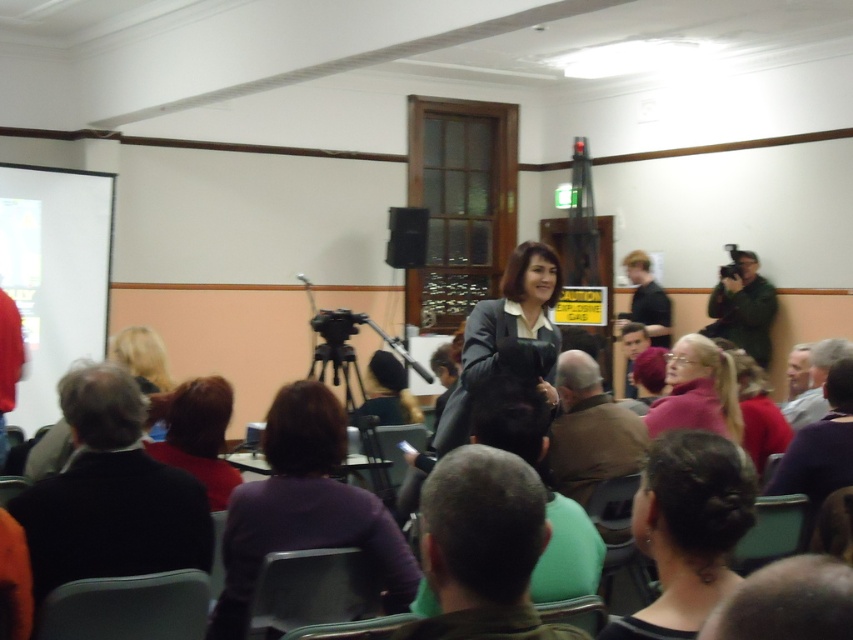
You are sitting in the audience and want to hand a note to the person wearing the black fabric jacket at lower left and the matte purple shirt at lower left. Which one is easier to reach without moving from your seat?

The black fabric jacket at lower left is closer to the viewer than the matte purple shirt at lower left, so it is easier to reach without moving from your seat.

You are sitting in the audience and notice two people in the front row. One is wearing a dark purple sweater at center and the other is wearing a black shirt at upper right. Which one is positioned more to the left?

The dark purple sweater at center is positioned more to the left than the black shirt at upper right.

Looking at this image, you are sitting in the audience and want to make eye contact with the presenter. Which object is closer to your line of sight between the dark purple sweater at center and the black shirt at upper right?

The dark purple sweater at center is closer to your line of sight because it is located below the black shirt at upper right, meaning it is positioned lower and nearer to the audience.